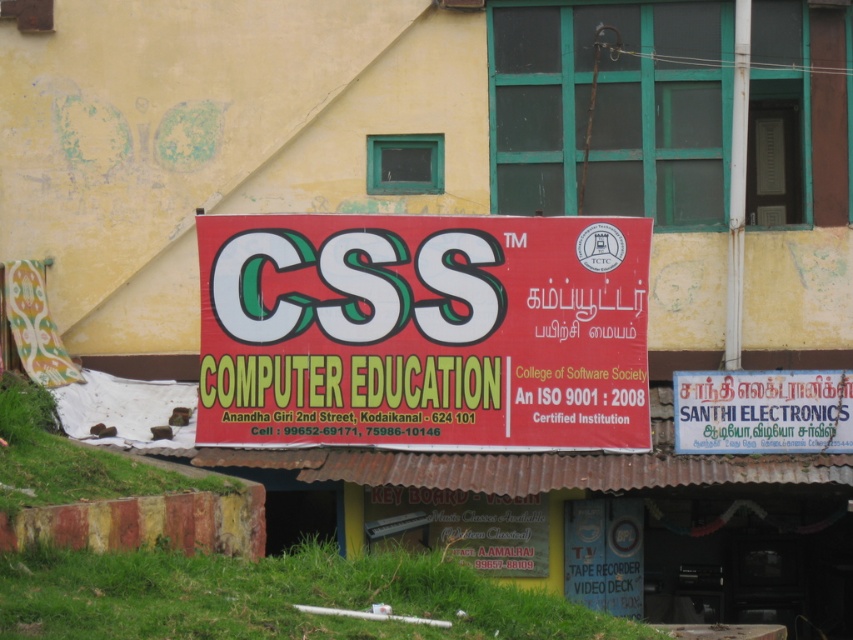
You are standing in front of the building and see both the red matte signboard at center and the white painted signboard at center. Which one is taller?

The red matte signboard at center is taller than the white painted signboard at center.

You are a visitor approaching the building and see both the red matte signboard at center and the white painted signboard at center. Which one do you think is bigger in size?

The red matte signboard at center is larger in size than the white painted signboard at center, so it is bigger in size.

You are a graphic designer who needs to create a new signboard for the building. The client wants the new signboard to be as wide as the existing white painted signboard at center. Given that the red matte signboard at center is currently occupying the central area, can you determine if the new signboard will fit in the same space without overlapping?

The red matte signboard at center is wider than the white painted signboard at center. Since the new signboard needs to be as wide as the white painted one, it will fit in the same space without overlapping the red matte signboard at center.